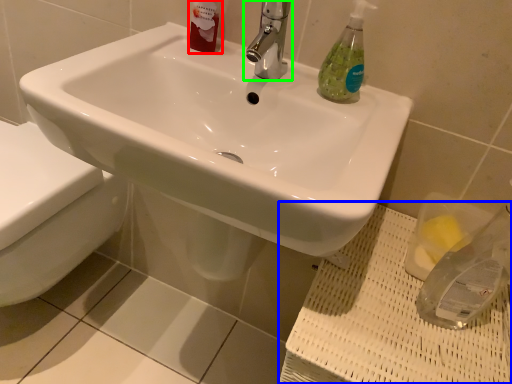
Question: Based on their relative distances, which object is nearer to toiletry (highlighted by a red box)? Choose from porcelain (highlighted by a blue box) and tap (highlighted by a green box).

Choices:
 (A) porcelain
 (B) tap

Answer: (B)